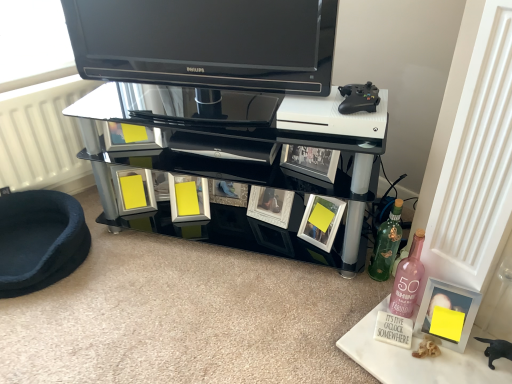
The height and width of the screenshot is (384, 512). In order to click on free space in front of pink glass bottle at lower right, which appears as the first bottle when viewed from the front in this screenshot , I will do `click(414, 365)`.